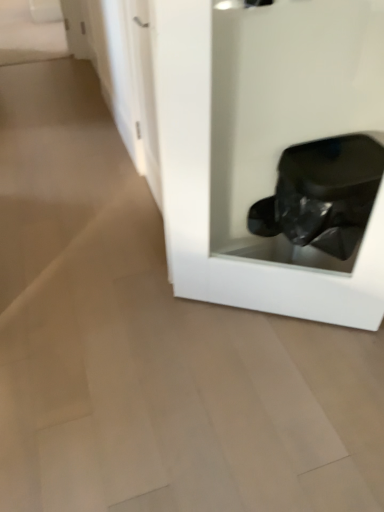
Question: From the image's perspective, is transparent glossy trash can at lower right above or below white glossy door at upper left?

Choices:
 (A) below
 (B) above

Answer: (A)

Question: Which is correct: transparent glossy trash can at lower right is inside white glossy door at upper left, or outside of it?

Choices:
 (A) inside
 (B) outside

Answer: (B)

Question: Considering the positions of point (210, 229) and point (152, 133), is point (210, 229) closer or farther from the camera than point (152, 133)?

Choices:
 (A) farther
 (B) closer

Answer: (A)

Question: From their relative heights in the image, would you say white glossy door at upper left is taller or shorter than transparent glossy trash can at lower right?

Choices:
 (A) tall
 (B) short

Answer: (B)

Question: In the image, is white glossy door at upper left on the left side or the right side of transparent glossy trash can at lower right?

Choices:
 (A) left
 (B) right

Answer: (A)

Question: Looking at their shapes, would you say white glossy door at upper left is wider or thinner than transparent glossy trash can at lower right?

Choices:
 (A) wide
 (B) thin

Answer: (B)

Question: Is white glossy door at upper left inside the boundaries of transparent glossy trash can at lower right, or outside?

Choices:
 (A) outside
 (B) inside

Answer: (A)